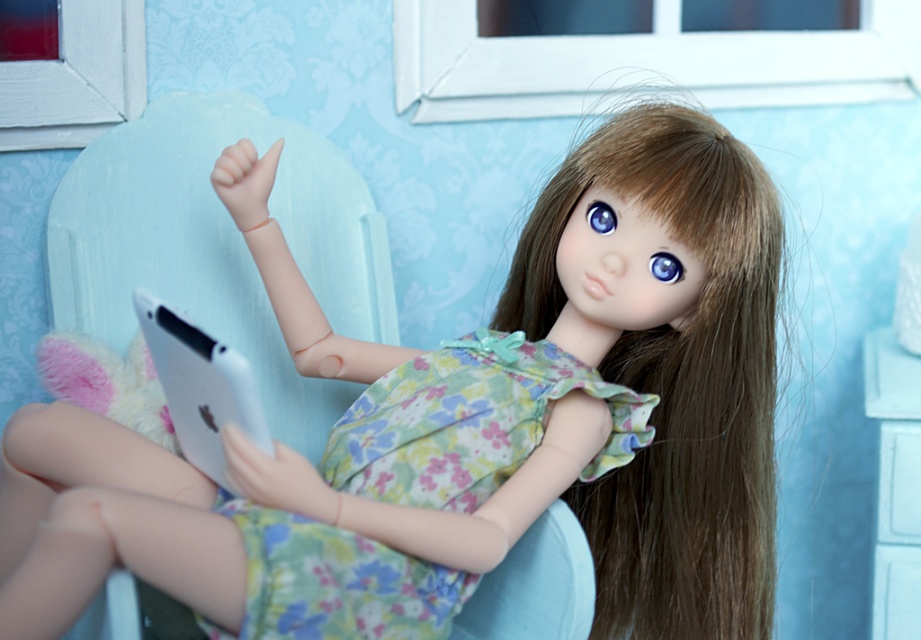
You are a tailor designing a new dress for the doll. You need to know which part of the doll is thinner to adjust the dress design. Which is thinner between the brown silky hair at center and the floral fabric dress at center?

The brown silky hair at center is thinner than the floral fabric dress at center, so you should adjust the dress design to accommodate the thinner brown silky hair at center.

You are a toy designer observing the doll in the image. You need to determine which of the two items, the brown silky hair at center or the floral fabric dress at center, requires more material to create. Based on the size comparison provided, which one would need more material?

The brown silky hair at center is larger in size than the floral fabric dress at center, so it would require more material to create.

What is the exact 2D coordinate location of the brown silky hair at center?

The brown silky hair at center is located at the 2D coordinate point of (677, 381).